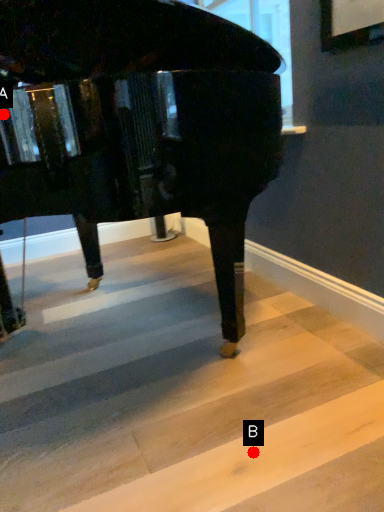
Question: Two points are circled on the image, labeled by A and B beside each circle. Which point is farther from the camera taking this photo?

Choices:
 (A) A is further
 (B) B is further

Answer: (A)